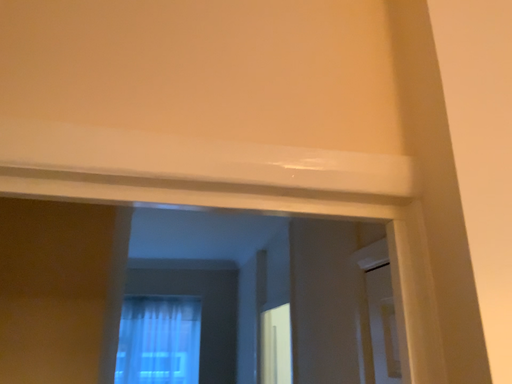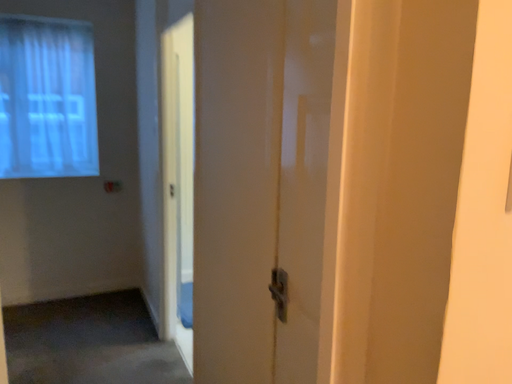
Question: How did the camera likely rotate when shooting the video?

Choices:
 (A) rotated right
 (B) rotated left

Answer: (A)